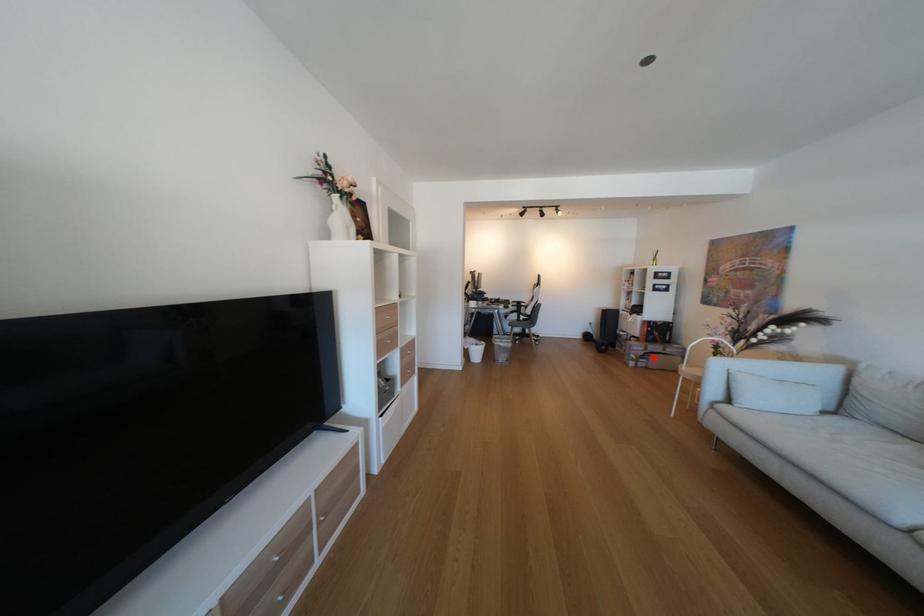
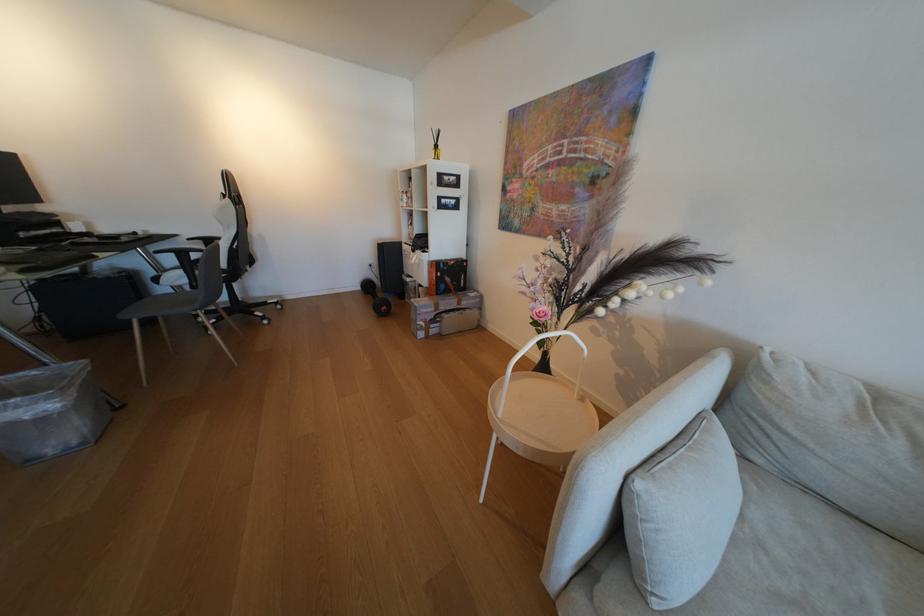
Find the pixel in the second image that matches the highlighted location in the first image.

(444, 322)